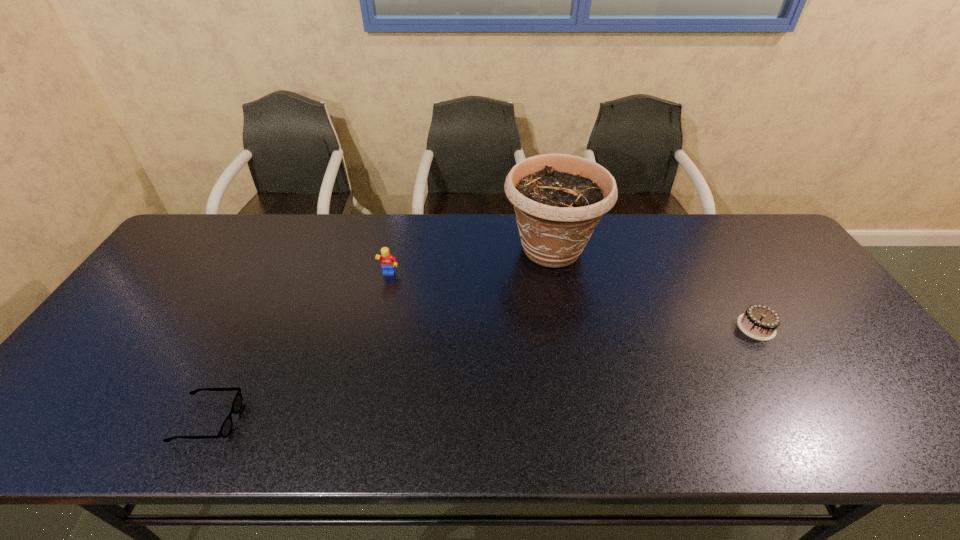
I want to click on free space that satisfies the following two spatial constraints: 1. on the face of the Lego; 2. on the arms of the shortest object, so click(x=357, y=420).

I want to click on blank space that satisfies the following two spatial constraints: 1. on the face of the third object from right to left; 2. on the right side of the chocolate cake, so click(377, 327).

This screenshot has height=540, width=960. I want to click on free point that satisfies the following two spatial constraints: 1. on the front side of the second nearest object; 2. on the right side of the flowerpot, so click(566, 327).

The image size is (960, 540). In order to click on vacant space that satisfies the following two spatial constraints: 1. on the front side of the tallest object; 2. on the right side of the third farthest object in this screenshot , I will do `click(566, 327)`.